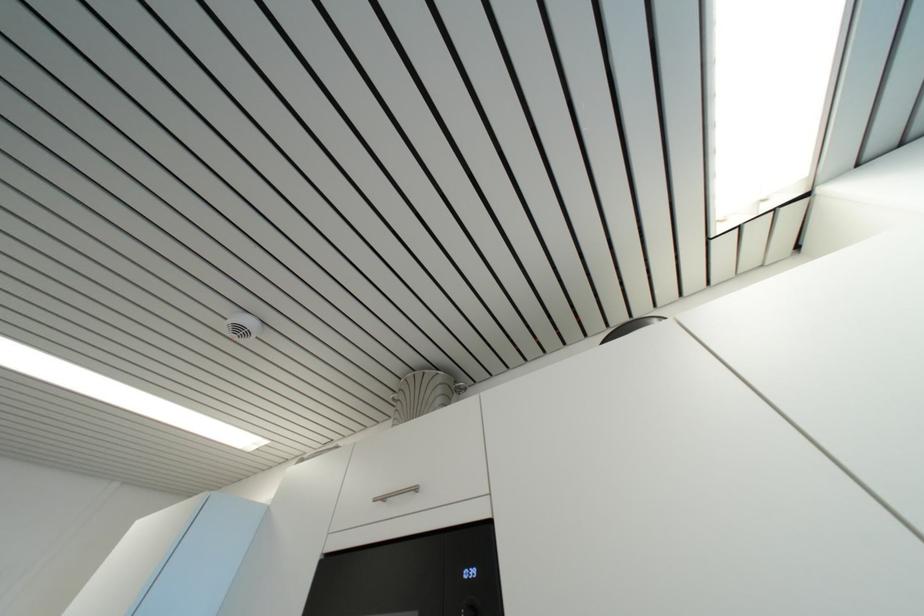
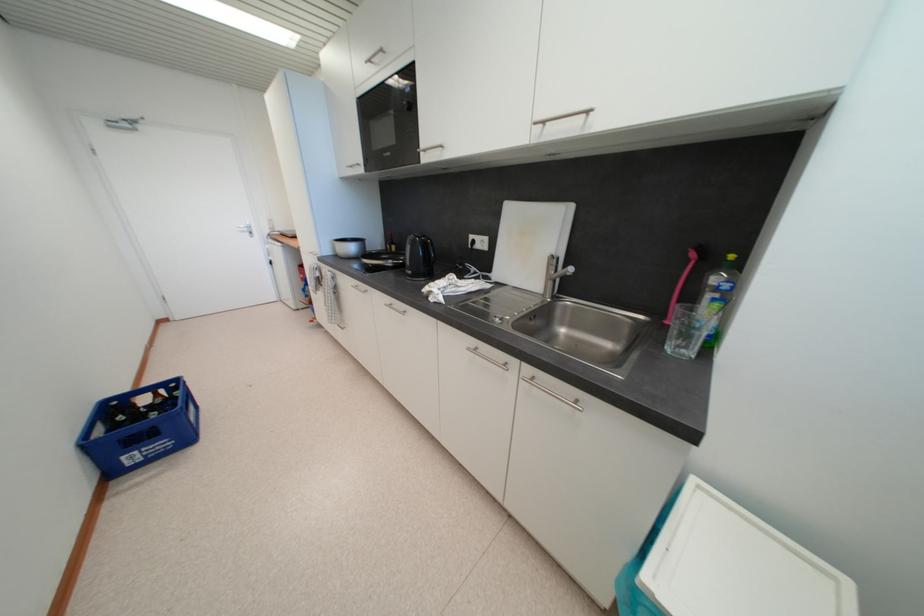
Locate, in the second image, the point that corresponds to pixel 387 501 in the first image.

(375, 63)